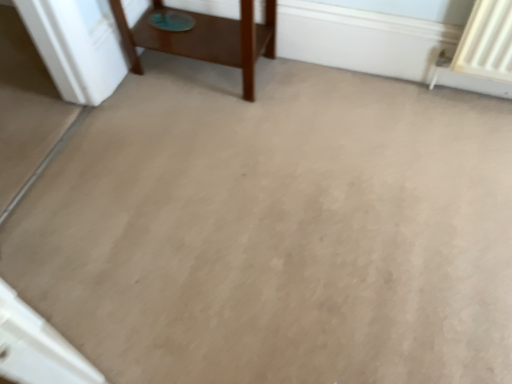
What do you see at coordinates (205, 39) in the screenshot? The height and width of the screenshot is (384, 512). I see `brown wooden table at upper left` at bounding box center [205, 39].

I want to click on brown wooden table at upper left, so 205,39.

The height and width of the screenshot is (384, 512). In order to click on brown wooden table at upper left in this screenshot , I will do pyautogui.click(x=205, y=39).